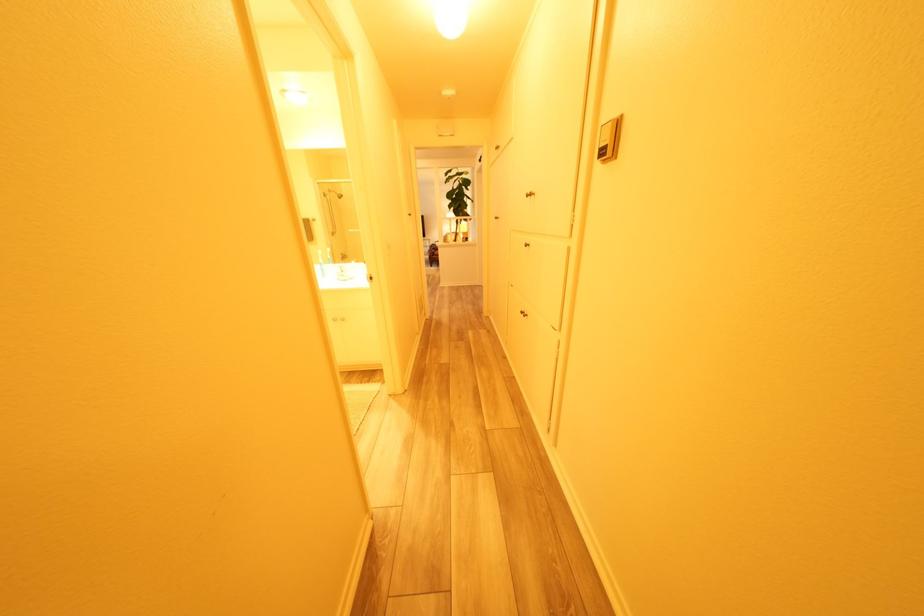
At what (x,y) coordinates should I click in order to perform the action: click on thermostat lever. Please return your answer as a coordinate pair (x, y). Looking at the image, I should click on (609, 139).